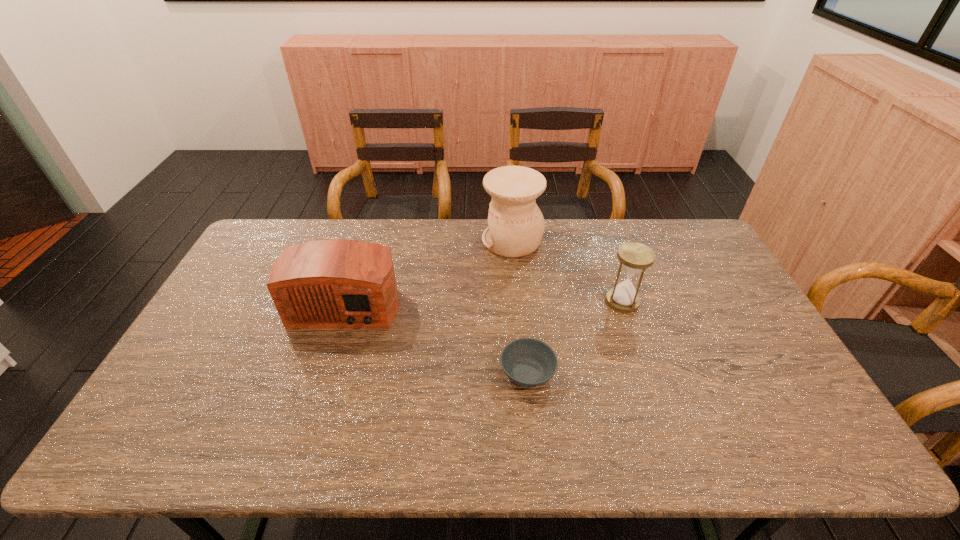
Where is `object that stands as the second closest to the tallest object`? The width and height of the screenshot is (960, 540). object that stands as the second closest to the tallest object is located at coordinates (336, 283).

I want to click on free point that satisfies the following two spatial constraints: 1. on the front-facing side of the rightmost object; 2. on the right side of the radio receiver, so click(346, 301).

Where is `free spot that satisfies the following two spatial constraints: 1. on the front-facing side of the hourglass; 2. on the left side of the radio receiver`? The height and width of the screenshot is (540, 960). free spot that satisfies the following two spatial constraints: 1. on the front-facing side of the hourglass; 2. on the left side of the radio receiver is located at coordinates (346, 301).

I want to click on free spot that satisfies the following two spatial constraints: 1. on the front-facing side of the hourglass; 2. on the right side of the leftmost object, so click(x=346, y=301).

Find the location of a particular element. This screenshot has width=960, height=540. vacant space that satisfies the following two spatial constraints: 1. at the open side of the pottery; 2. on the left side of the hourglass is located at coordinates (517, 301).

The image size is (960, 540). Find the location of `free region that satisfies the following two spatial constraints: 1. at the open side of the pottery; 2. on the right side of the rightmost object`. free region that satisfies the following two spatial constraints: 1. at the open side of the pottery; 2. on the right side of the rightmost object is located at coordinates (517, 301).

This screenshot has height=540, width=960. I want to click on free spot that satisfies the following two spatial constraints: 1. on the front-facing side of the soup bowl; 2. on the right side of the leftmost object, so click(x=324, y=373).

Where is `vacant region that satisfies the following two spatial constraints: 1. at the open side of the pottery; 2. on the right side of the soup bowl`? vacant region that satisfies the following two spatial constraints: 1. at the open side of the pottery; 2. on the right side of the soup bowl is located at coordinates (524, 373).

This screenshot has width=960, height=540. Find the location of `vacant area that satisfies the following two spatial constraints: 1. at the open side of the pottery; 2. on the front-facing side of the leftmost object`. vacant area that satisfies the following two spatial constraints: 1. at the open side of the pottery; 2. on the front-facing side of the leftmost object is located at coordinates (517, 301).

Identify the location of free point that satisfies the following two spatial constraints: 1. at the open side of the pottery; 2. on the front-facing side of the radio receiver. The height and width of the screenshot is (540, 960). (517, 301).